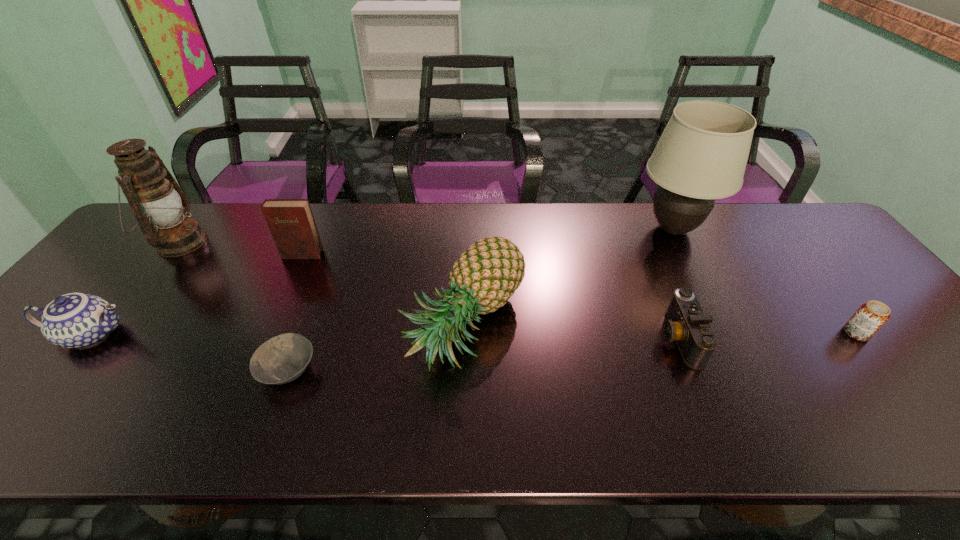
Locate an element on the screen. The width and height of the screenshot is (960, 540). diary that is positioned at the far edge is located at coordinates (291, 222).

Locate an element on the screen. This screenshot has width=960, height=540. lantern at the left edge is located at coordinates (154, 196).

Identify the location of chinaware positioned at the left edge. This screenshot has height=540, width=960. (75, 320).

Locate an element on the screen. object at the right edge is located at coordinates (871, 316).

At what (x,y) coordinates should I click in order to perform the action: click on object that is positioned at the far left corner. Please return your answer as a coordinate pair (x, y). The height and width of the screenshot is (540, 960). Looking at the image, I should click on (154, 196).

What are the coordinates of `free space at the far edge of the desktop` in the screenshot? It's located at (346, 205).

Identify the location of free space at the near edge of the desktop. (x=150, y=427).

Identify the location of blank space at the left edge. (34, 347).

In the image, there is a desktop. Where is `vacant space at the right edge`? Image resolution: width=960 pixels, height=540 pixels. vacant space at the right edge is located at coordinates (903, 327).

Where is `vacant space at the far right corner of the desktop`? Image resolution: width=960 pixels, height=540 pixels. vacant space at the far right corner of the desktop is located at coordinates (814, 241).